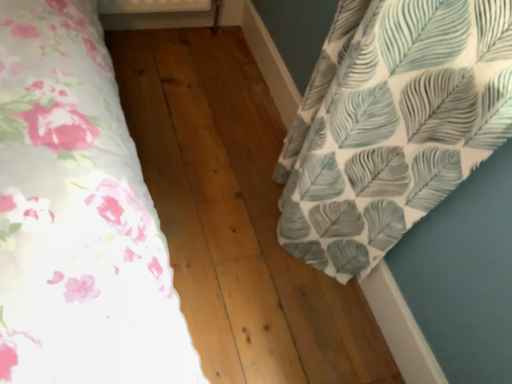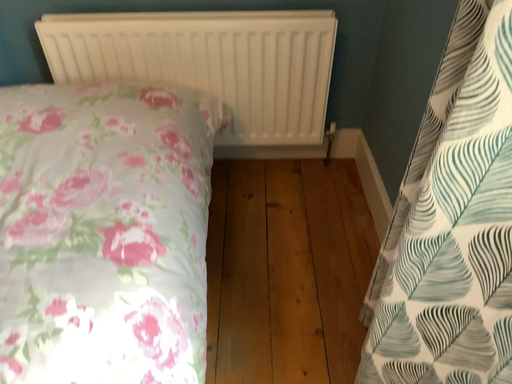
Question: Which way did the camera rotate in the video?

Choices:
 (A) rotated downward
 (B) rotated upward

Answer: (B)